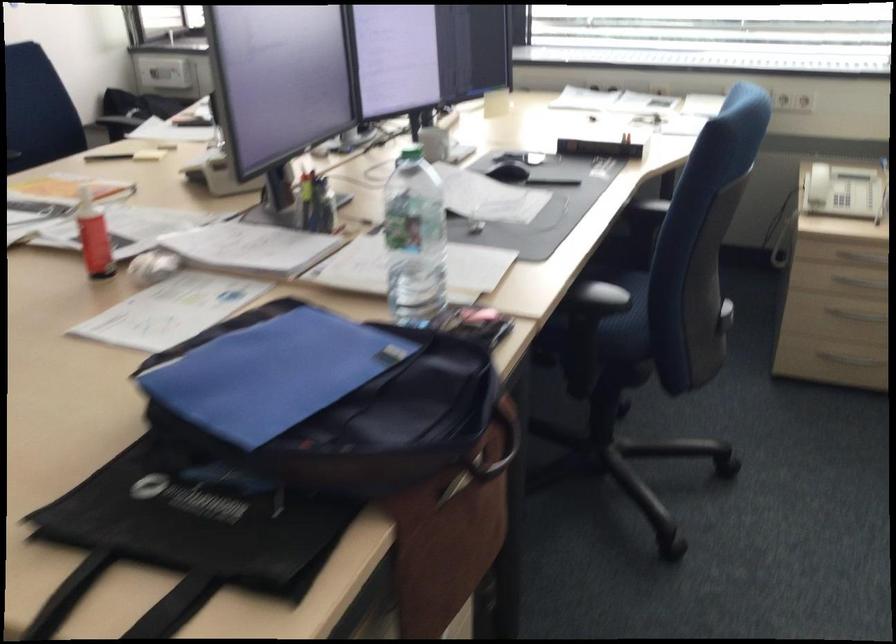
What do you see at coordinates (817, 182) in the screenshot?
I see `the telephone handset` at bounding box center [817, 182].